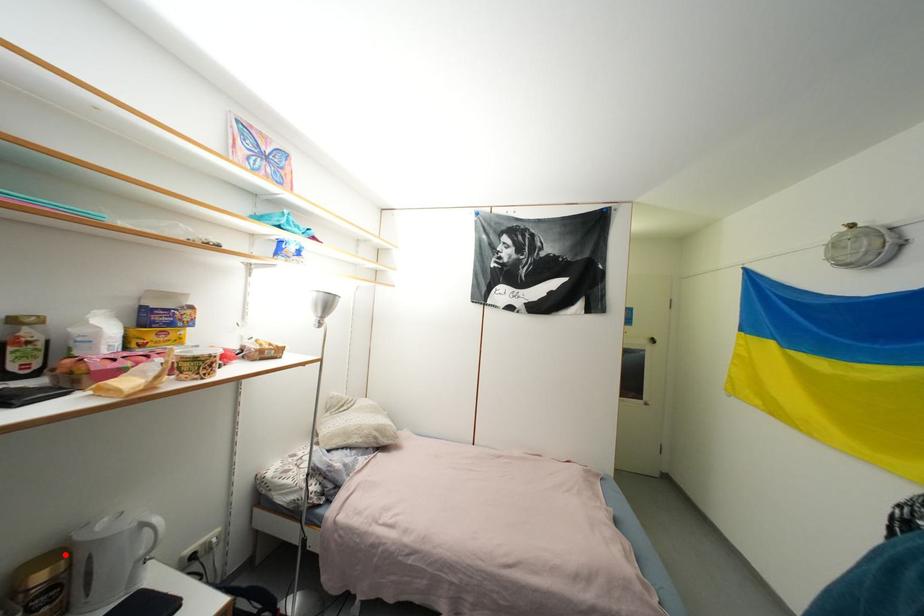
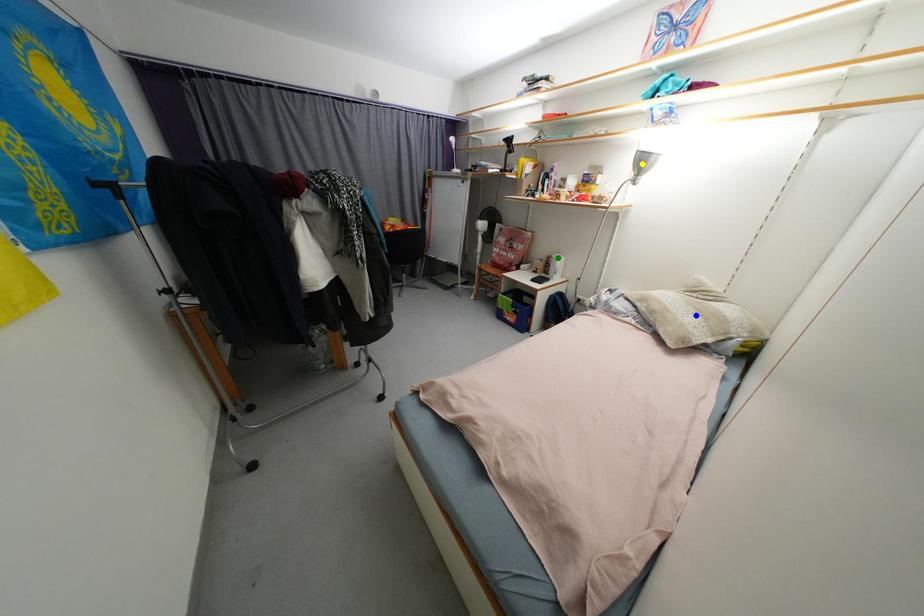
Question: I am providing you with two images of the same scene from different viewpoints. A red point is marked on the first image. You are given multiple points on the second image. Which spot in image 2 lines up with the point in image 1?

Choices:
 (A) blue point
 (B) yellow point
 (C) green point

Answer: (C)